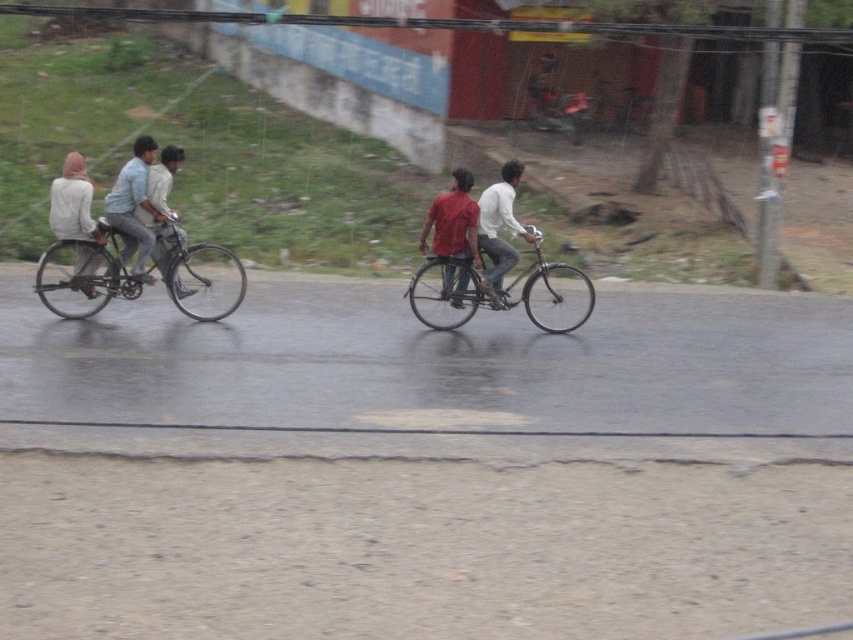
Can you confirm if shiny metallic bicycle at left is smaller than matte red shirt at center?

Incorrect, shiny metallic bicycle at left is not smaller in size than matte red shirt at center.

Is shiny metallic bicycle at left wider than matte red shirt at center?

Indeed, shiny metallic bicycle at left has a greater width compared to matte red shirt at center.

Where is `shiny metallic bicycle at left`? The height and width of the screenshot is (640, 853). shiny metallic bicycle at left is located at coordinates (201, 276).

Locate an element on the screen. This screenshot has height=640, width=853. shiny metallic bicycle at left is located at coordinates (201, 276).

Does metallic silver bicycle at center appear on the right side of light blue denim shirt at left?

Yes, metallic silver bicycle at center is to the right of light blue denim shirt at left.

Between metallic silver bicycle at center and light blue denim shirt at left, which one is positioned lower?

metallic silver bicycle at center is lower down.

The height and width of the screenshot is (640, 853). What are the coordinates of `metallic silver bicycle at center` in the screenshot? It's located at (503, 289).

Is point (552, 304) in front of point (149, 193)?

No, (552, 304) is behind (149, 193).

Can you confirm if metallic silver bicycle at center is positioned to the left of light blue shirt at left?

Incorrect, metallic silver bicycle at center is not on the left side of light blue shirt at left.

Which is in front, point (450, 301) or point (167, 228)?

Point (167, 228)

Locate an element on the screen. The width and height of the screenshot is (853, 640). metallic silver bicycle at center is located at coordinates (503, 289).